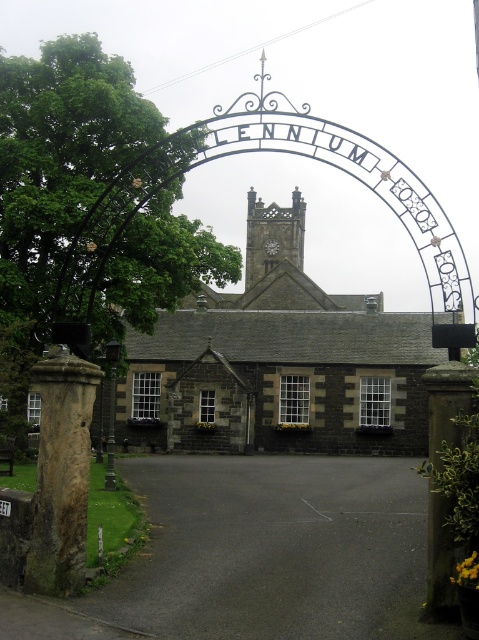
You are a visitor arriving at the entrance and want to park your car near the dark gray stone church at center. The black asphalt driveway at center is the only paved path available. Based on the scene description, can you determine if the driveway is positioned in a suitable location for parking near the church?

The black asphalt driveway at center is positioned on the left side of the dark gray stone church at center, so yes, the driveway is on the left side of the church, making it a suitable location for parking near the church.

You are a visitor approaching the grand entrance gate. You notice the dark gray stone church at center and the brown stone pillar at left. Which structure appears larger from your perspective?

The dark gray stone church at center appears larger than the brown stone pillar at left from your perspective.

You are standing in front of the grand entrance gate. You need to take a photo of the dark gray stone church at center and the brown stone pillar at left. Which object should you focus on first if you want to include both in the frame without moving the camera?

The dark gray stone church at center is much taller than the brown stone pillar at left, so you should focus on the church first to ensure its full height fits in the frame while still capturing the pillar.